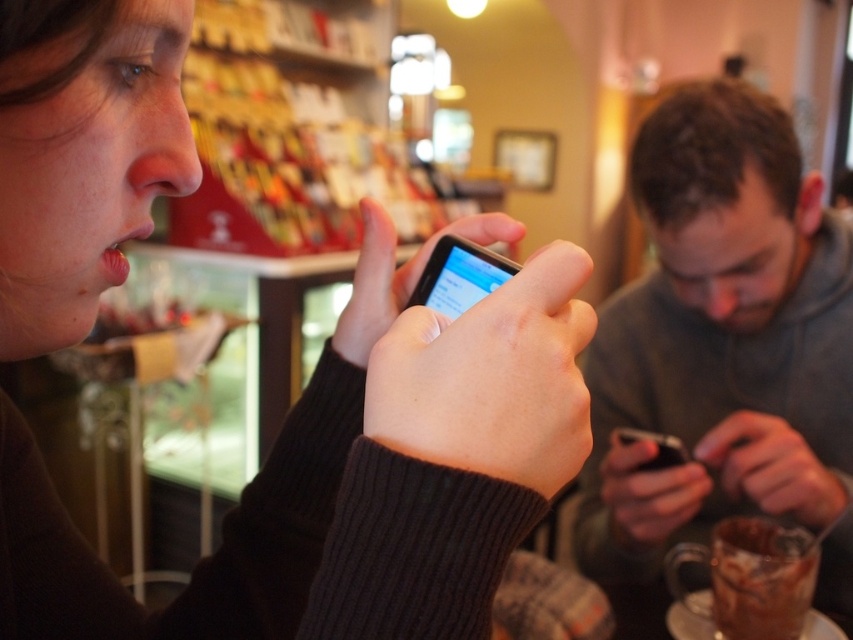
Question: Which point is closer to the camera taking this photo?

Choices:
 (A) (718, 266)
 (B) (518, 499)

Answer: (B)

Question: Which of the following is the farthest from the observer?

Choices:
 (A) gray hoodie at center
 (B) matte black phone at center

Answer: (A)

Question: Does matte black phone at center lie behind gray hoodie at center?

Choices:
 (A) yes
 (B) no

Answer: (B)

Question: Which object appears farthest from the camera in this image?

Choices:
 (A) matte black phone at center
 (B) gray hoodie at center

Answer: (B)

Question: Can you confirm if matte black phone at center is thinner than gray hoodie at center?

Choices:
 (A) yes
 (B) no

Answer: (A)

Question: Can you confirm if matte black phone at center is smaller than gray hoodie at center?

Choices:
 (A) no
 (B) yes

Answer: (B)